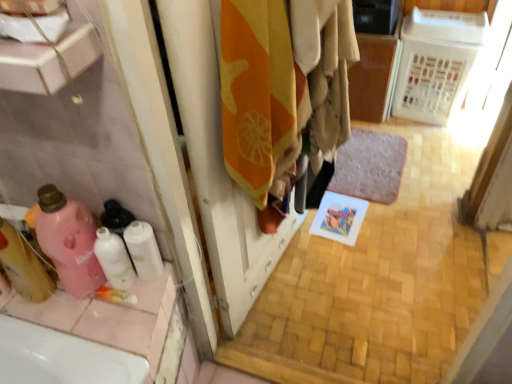
Question: Considering the relative sizes of orange fabric at center and white matte toilet paper at lower left in the image provided, is orange fabric at center wider than white matte toilet paper at lower left?

Choices:
 (A) yes
 (B) no

Answer: (B)

Question: Does orange fabric at center have a larger size compared to white matte toilet paper at lower left?

Choices:
 (A) yes
 (B) no

Answer: (A)

Question: From a real-world perspective, does orange fabric at center sit lower than white matte toilet paper at lower left?

Choices:
 (A) yes
 (B) no

Answer: (A)

Question: Can you confirm if orange fabric at center is positioned to the right of white matte toilet paper at lower left?

Choices:
 (A) yes
 (B) no

Answer: (A)

Question: From a real-world perspective, is orange fabric at center physically above white matte toilet paper at lower left?

Choices:
 (A) yes
 (B) no

Answer: (B)

Question: From the image's perspective, is orange fabric at center located above white matte toilet paper at lower left?

Choices:
 (A) no
 (B) yes

Answer: (B)

Question: Is pink matte bottle at lower left, acting as the 2th cleaning product starting from the left, not within gray plush bath mat at center?

Choices:
 (A) no
 (B) yes

Answer: (B)

Question: Can you confirm if pink matte bottle at lower left, acting as the 2th cleaning product starting from the left, is bigger than gray plush bath mat at center?

Choices:
 (A) yes
 (B) no

Answer: (B)

Question: From a real-world perspective, does pink matte bottle at lower left, acting as the 2th cleaning product starting from the left, stand above gray plush bath mat at center?

Choices:
 (A) no
 (B) yes

Answer: (B)

Question: From the image's perspective, would you say pink matte bottle at lower left, acting as the 2th cleaning product starting from the left, is positioned over gray plush bath mat at center?

Choices:
 (A) yes
 (B) no

Answer: (B)

Question: From a real-world perspective, is pink matte bottle at lower left, which is counted as the second cleaning product, starting from the right, below gray plush bath mat at center?

Choices:
 (A) yes
 (B) no

Answer: (B)

Question: Would you consider pink matte bottle at lower left, acting as the 2th cleaning product starting from the left, to be distant from gray plush bath mat at center?

Choices:
 (A) yes
 (B) no

Answer: (A)

Question: Would you say translucent pink bottle at left, which ranks as the third cleaning product in right-to-left order, is outside orange fabric at center?

Choices:
 (A) yes
 (B) no

Answer: (A)